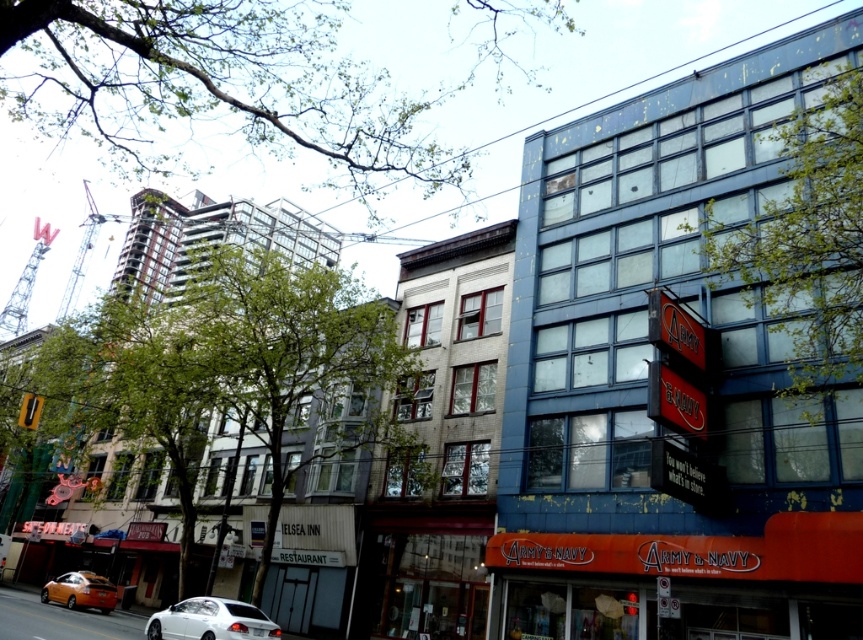
Can you confirm if white glossy sedan at lower center is positioned to the left of orange matte car at lower left?

No, white glossy sedan at lower center is not to the left of orange matte car at lower left.

Is white glossy sedan at lower center smaller than orange matte car at lower left?

Correct, white glossy sedan at lower center occupies less space than orange matte car at lower left.

The width and height of the screenshot is (863, 640). Find the location of `white glossy sedan at lower center`. white glossy sedan at lower center is located at coordinates (210, 620).